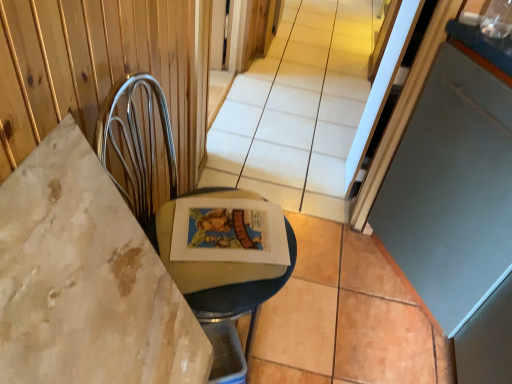
Question: Based on their sizes in the image, would you say metallic silver swivel chair at left is bigger or smaller than matte gray screen door at right?

Choices:
 (A) small
 (B) big

Answer: (A)

Question: From the image's perspective, is metallic silver swivel chair at left positioned above or below matte gray screen door at right?

Choices:
 (A) above
 (B) below

Answer: (B)

Question: In the image, is metallic silver swivel chair at left positioned in front of or behind matte gray screen door at right?

Choices:
 (A) front
 (B) behind

Answer: (A)

Question: Is matte gray screen door at right to the left or to the right of metallic silver swivel chair at left in the image?

Choices:
 (A) left
 (B) right

Answer: (B)

Question: Considering the positions of matte gray screen door at right and metallic silver swivel chair at left in the image, is matte gray screen door at right bigger or smaller than metallic silver swivel chair at left?

Choices:
 (A) big
 (B) small

Answer: (A)

Question: From a real-world perspective, relative to metallic silver swivel chair at left, is matte gray screen door at right vertically above or below?

Choices:
 (A) above
 (B) below

Answer: (A)

Question: Is point (428, 264) positioned closer to the camera than point (131, 182)?

Choices:
 (A) farther
 (B) closer

Answer: (A)